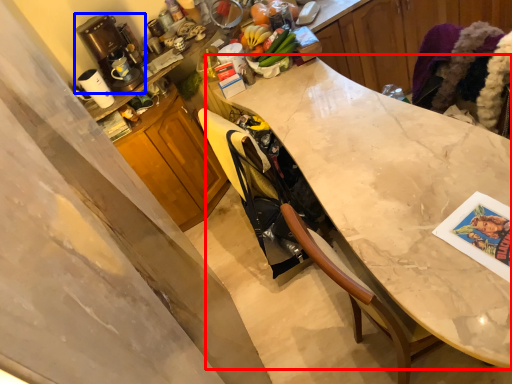
Question: Among these objects, which one is nearest to the camera, countertop (highlighted by a red box) or coffee machine (highlighted by a blue box)?

Choices:
 (A) countertop
 (B) coffee machine

Answer: (A)